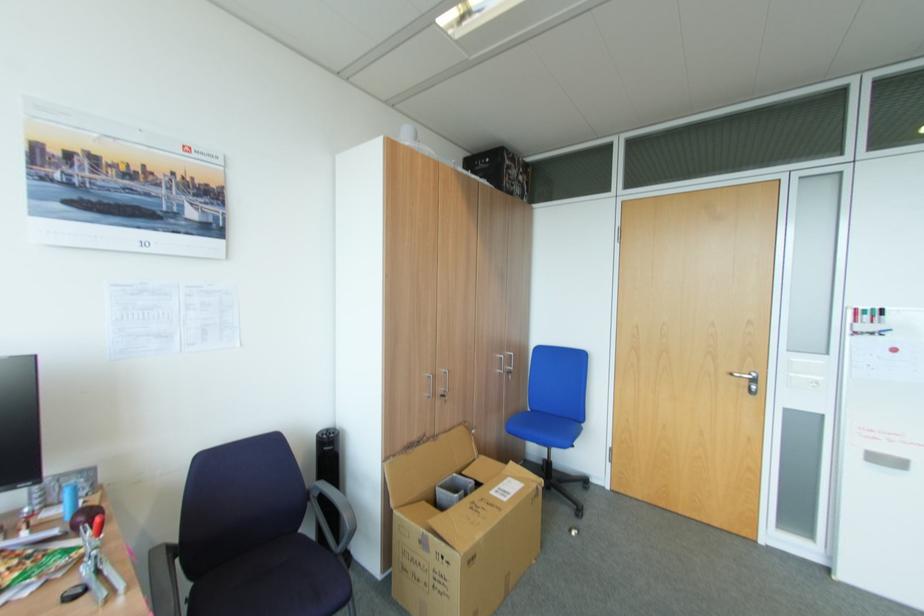
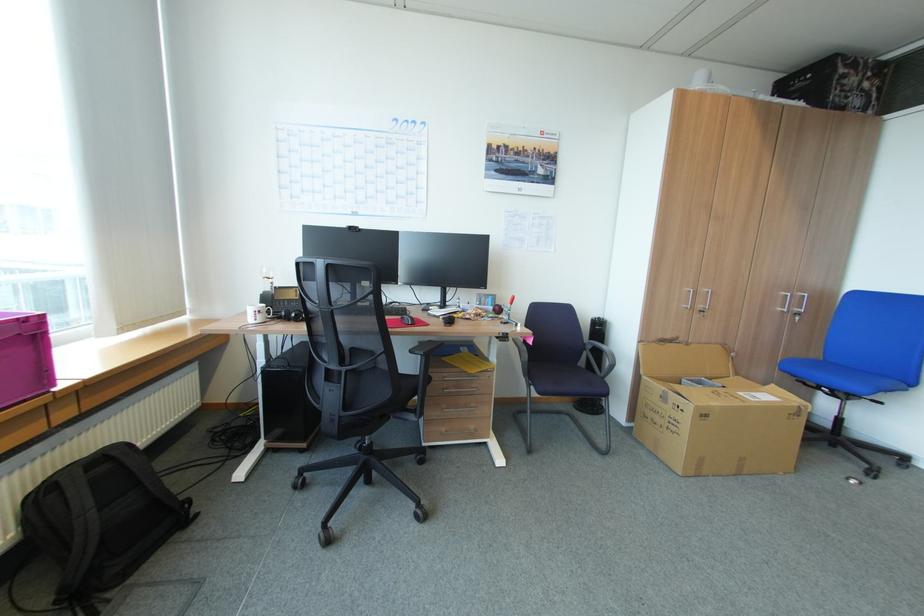
Find the pixel in the second image that matches pixel 312 487 in the first image.

(590, 342)